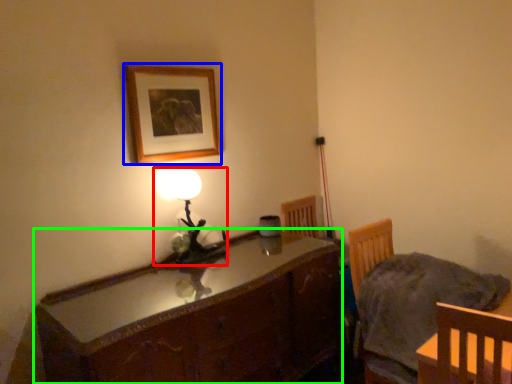
Question: Based on their relative distances, which object is farther from lamp (highlighted by a red box)? Choose from picture frame (highlighted by a blue box) and cabinetry (highlighted by a green box).

Choices:
 (A) picture frame
 (B) cabinetry

Answer: (B)